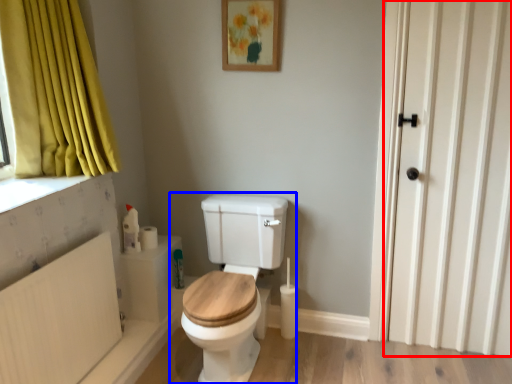
Question: Which point is closer to the camera, door (highlighted by a red box) or toilet (highlighted by a blue box)?

Choices:
 (A) door
 (B) toilet

Answer: (B)